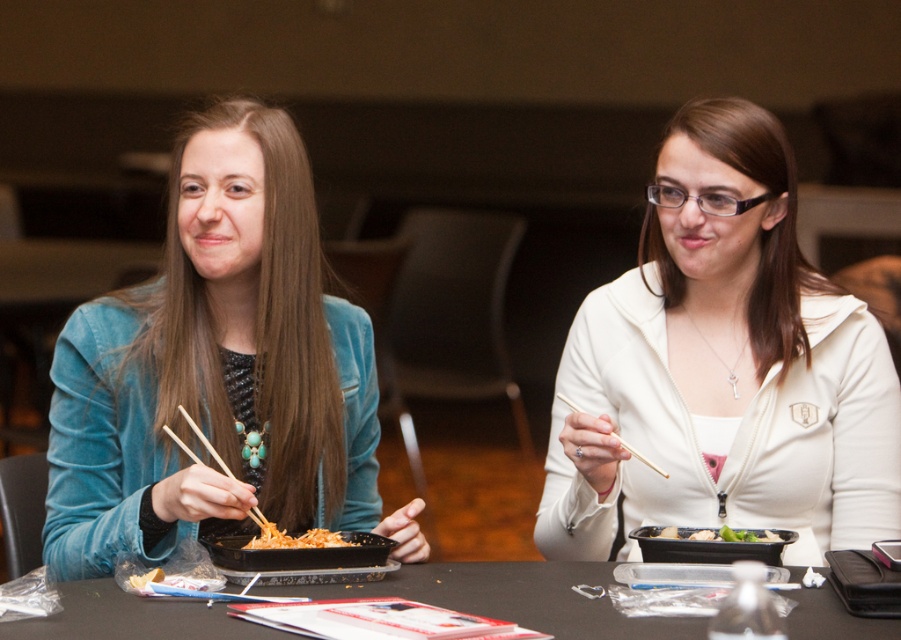
Based on the photo, can you confirm if white matte jacket at center is positioned to the left of black plastic tray at center?

No, white matte jacket at center is not to the left of black plastic tray at center.

Where is `white matte jacket at center`? white matte jacket at center is located at coordinates (724, 365).

Can you confirm if green leafy vegetable at center is positioned below wooden chopsticks at upper center?

Yes.

The image size is (901, 640). Describe the element at coordinates (721, 534) in the screenshot. I see `green leafy vegetable at center` at that location.

This screenshot has height=640, width=901. I want to click on green leafy vegetable at center, so click(x=721, y=534).

Does shiny orange noodles at center have a smaller size compared to wooden chopsticks at left?

Yes.

Who is shorter, shiny orange noodles at center or wooden chopsticks at left?

With less height is shiny orange noodles at center.

Does point (285, 545) come in front of point (224, 467)?

That is False.

Find the location of a particular element. The height and width of the screenshot is (640, 901). shiny orange noodles at center is located at coordinates (296, 538).